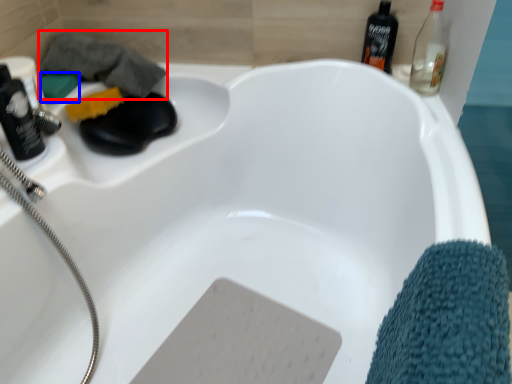
Question: Among these objects, which one is nearest to the camera, bath towel (highlighted by a red box) or soap (highlighted by a blue box)?

Choices:
 (A) bath towel
 (B) soap

Answer: (A)